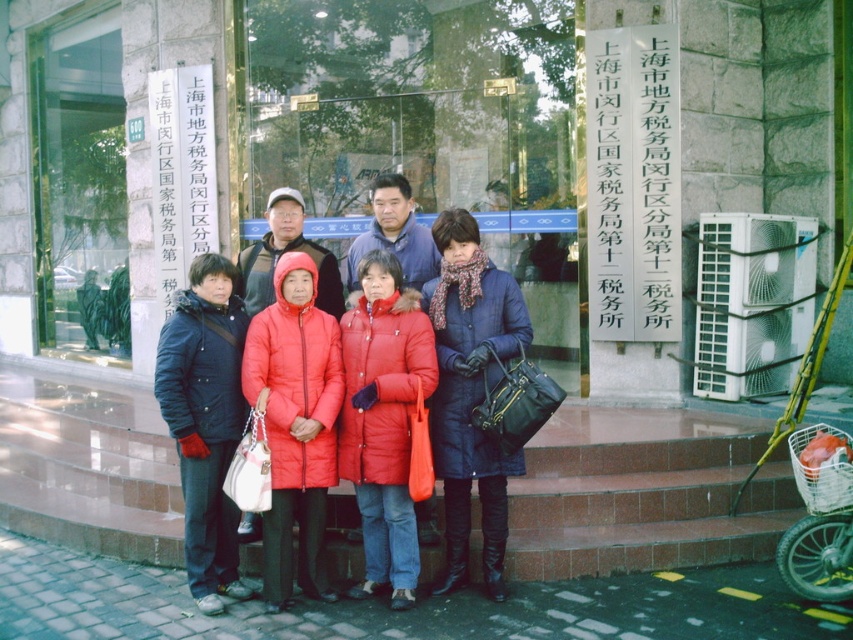
Question: Which is farther from the denim coat at center?

Choices:
 (A) red matte coat at center
 (B) matte blue jacket at center
 (C) red down jackets at center

Answer: (B)

Question: Which point appears farthest from the camera in this image?

Choices:
 (A) coord(244,348)
 (B) coord(184,356)
 (C) coord(256,308)
 (D) coord(427,337)

Answer: (C)

Question: Can you confirm if red down coat at center is positioned to the left of red matte coat at center?

Choices:
 (A) no
 (B) yes

Answer: (A)

Question: Is red down jackets at center to the right of denim coat at center from the viewer's perspective?

Choices:
 (A) no
 (B) yes

Answer: (A)

Question: Which point appears farthest from the camera in this image?

Choices:
 (A) [459, 336]
 (B) [323, 301]
 (C) [318, 388]

Answer: (B)

Question: Is matte red puffer coat at center closer to camera compared to denim coat at center?

Choices:
 (A) no
 (B) yes

Answer: (B)